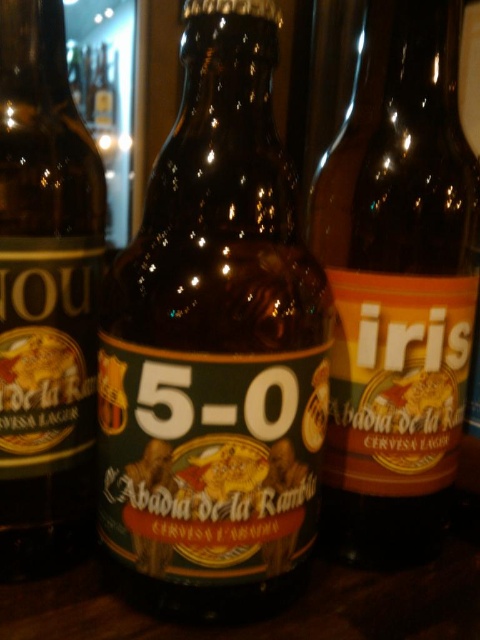
You are at a bar and want to order a beer. The bartender points to the bottle at point (397, 288). Which beer bottle should you choose?

The matte glass bottle at right is represented by point (397, 288).

You are a bartender trying to fit two bottles on a shelf that can only accommodate a total width of 30 cm. The matte glass bottle at right and the brown glass bottle at left are both available. Can you fit both bottles on the shelf without exceeding the width limit?

The matte glass bottle at right is wider than the brown glass bottle at left. Since the total width of both bottles combined would exceed 30 cm, they cannot both fit on the shelf.

You are at a bar and want to grab the brown glass bottle at center. However, there is a brown glass bottle at left blocking your path. Can you reach the center bottle without moving the left one?

The brown glass bottle at center is shorter than the brown glass bottle at left, so you might be able to reach around or over the taller left bottle to grab the center one without moving it.